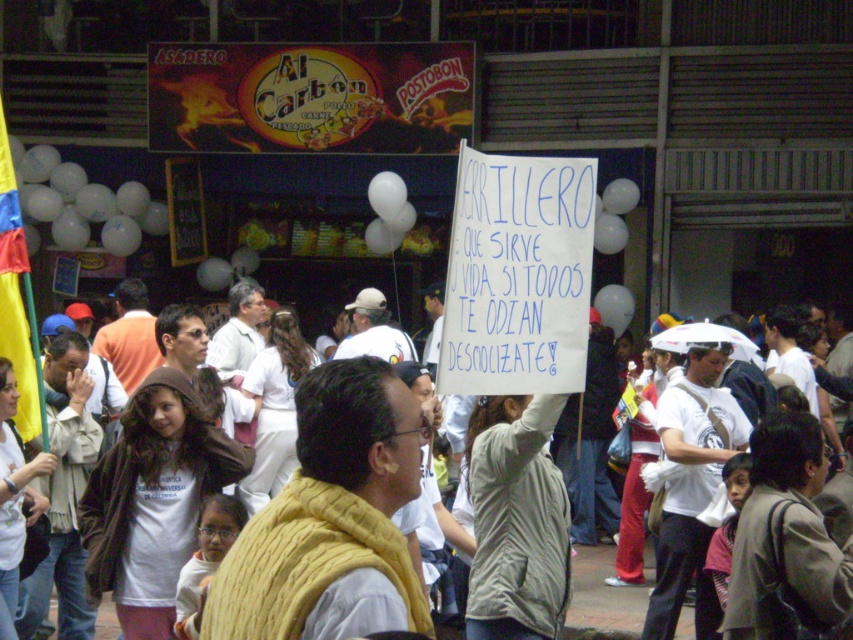
Question: Among these points, which one is farthest from the camera?

Choices:
 (A) (606, 605)
 (B) (381, 320)

Answer: (B)

Question: Is white paper sign at upper center positioned in front of orange cotton shirt at center?

Choices:
 (A) no
 (B) yes

Answer: (B)

Question: Considering the relative positions of white cotton t-shirt at center and white paper sign at upper center in the image provided, where is white cotton t-shirt at center located with respect to white paper sign at upper center?

Choices:
 (A) above
 (B) below

Answer: (A)

Question: Is yellow knitted vest at center above white cotton shirt at upper center?

Choices:
 (A) yes
 (B) no

Answer: (B)

Question: Which object is the farthest from the white matte baseball cap at center?

Choices:
 (A) white matte shirt at center
 (B) white cotton shirt at center
 (C) white paper sign at upper center

Answer: (C)

Question: Which point is farther from the camera taking this photo?

Choices:
 (A) (432, 348)
 (B) (225, 344)
 (C) (119, 308)

Answer: (A)